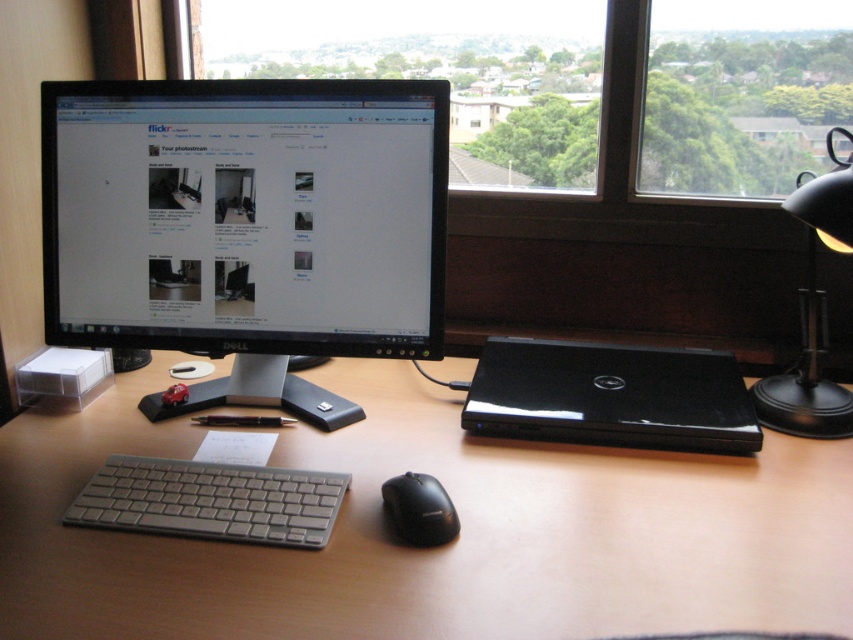
Question: Does wooden at center appear on the left side of transparent glass window at upper right?

Choices:
 (A) no
 (B) yes

Answer: (B)

Question: Is transparent glass window at upper right bigger than black metal desk lamp at right?

Choices:
 (A) yes
 (B) no

Answer: (A)

Question: Which is nearer to the black glossy monitor at upper left?

Choices:
 (A) transparent glass window at center
 (B) black metal desk lamp at right
 (C) black glossy laptop at right

Answer: (C)

Question: In this image, where is wooden at center located relative to black matte mouse at center?

Choices:
 (A) above
 (B) below

Answer: (A)

Question: Estimate the real-world distances between objects in this image. Which object is closer to the black metal desk lamp at right?

Choices:
 (A) black glossy laptop at right
 (B) black glossy monitor at upper left
 (C) transparent glass window at center

Answer: (A)

Question: Which object appears closest to the camera in this image?

Choices:
 (A) transparent glass window at upper right
 (B) wooden at center
 (C) black metal desk lamp at right

Answer: (B)